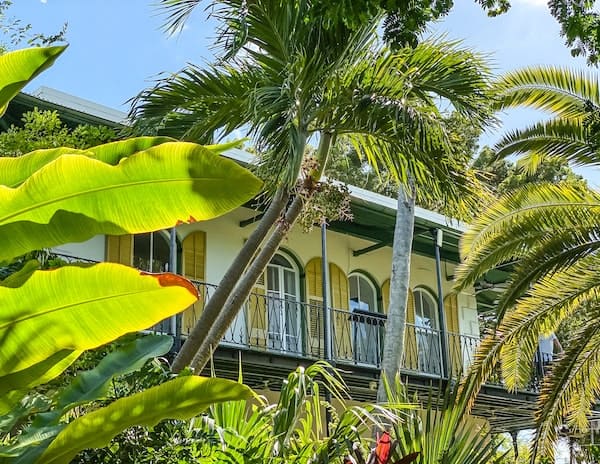
Where is `doorway`? The image size is (600, 464). doorway is located at coordinates (150, 246), (284, 280), (360, 284), (427, 299).